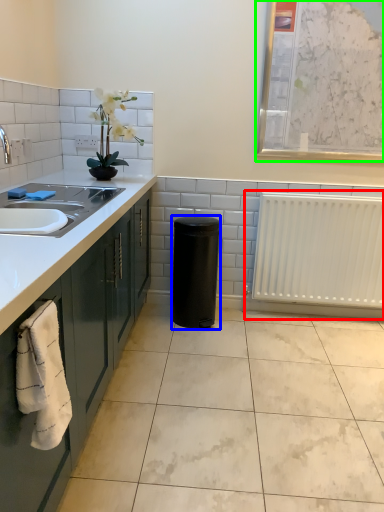
Question: Considering the real-world distances, which object is farthest from radiator (highlighted by a red box)? appliance (highlighted by a blue box) or bulletin board (highlighted by a green box)?

Choices:
 (A) appliance
 (B) bulletin board

Answer: (B)